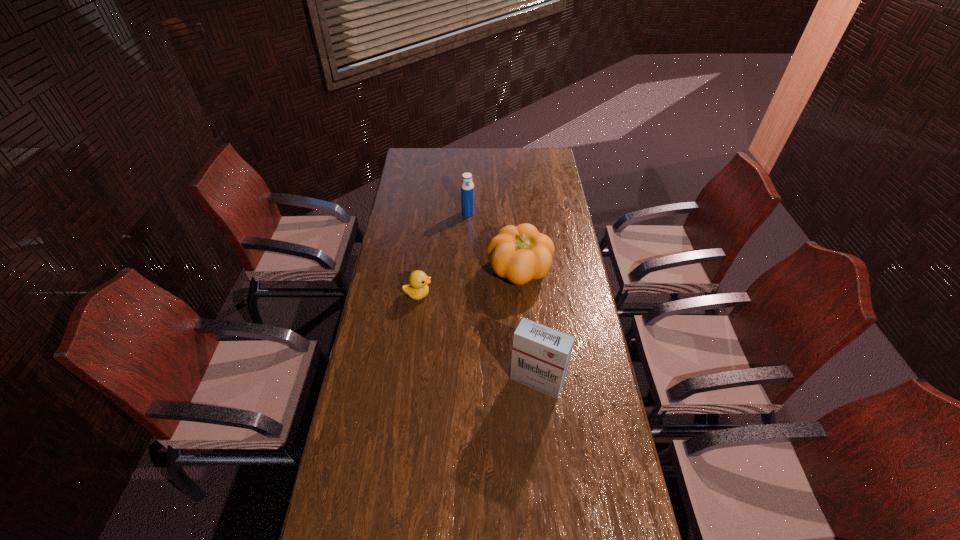
Locate an element on the screen. The height and width of the screenshot is (540, 960). cigarette case is located at coordinates (540, 357).

Identify the location of the tallest object. The height and width of the screenshot is (540, 960). (540, 357).

At what (x,y) coordinates should I click in order to perform the action: click on the farthest object. Please return your answer as a coordinate pair (x, y). This screenshot has height=540, width=960. Looking at the image, I should click on (467, 187).

The width and height of the screenshot is (960, 540). I want to click on the third object from right to left, so click(x=467, y=187).

Where is `pumpkin`? pumpkin is located at coordinates (520, 253).

At what (x,y) coordinates should I click in order to perform the action: click on duck. Please return your answer as a coordinate pair (x, y). Looking at the image, I should click on (417, 289).

Image resolution: width=960 pixels, height=540 pixels. Identify the location of the leftmost object. (417, 289).

Where is `vacant area situated 0.290m on the front of the tallest object`? This screenshot has width=960, height=540. vacant area situated 0.290m on the front of the tallest object is located at coordinates [x=548, y=493].

You are a GUI agent. You are given a task and a screenshot of the screen. Output one action in this format:
    pyautogui.click(x=<x>, y=<y>)
    Task: Click on the free spot located 0.330m on the back of the third object from right to left
    This screenshot has width=960, height=540.
    Given the screenshot: What is the action you would take?
    pyautogui.click(x=469, y=172)

At what (x,y) coordinates should I click in order to perform the action: click on vacant space positioned on the right of the pumpkin. Please return your answer as a coordinate pair (x, y). The height and width of the screenshot is (540, 960). Looking at the image, I should click on point(576,272).